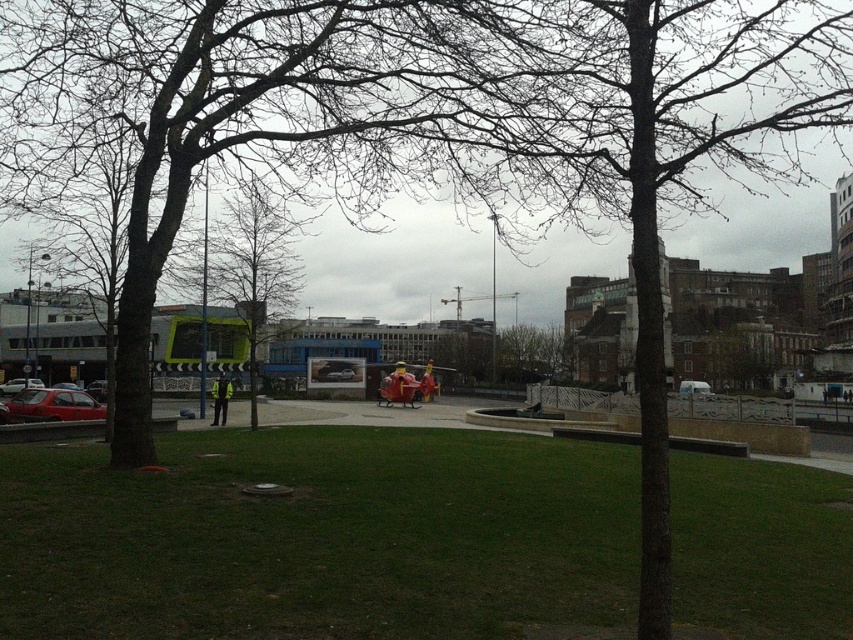
You are standing at the bottom left corner of the park and want to walk to the red helicopter model in the middle ground. Which direction should you head to avoid stepping on the green grass at center?

You should head towards the paved area where the red helicopter model is located, as the green grass at center is located at point (318,536), which is away from the paved path.

You are a pedestrian standing at the edge of the park and want to cross to the other side. There is a matte red car at lower left and a high visibility yellow jacket at center in your path. Which object should you avoid first while crossing?

You should avoid the matte red car at lower left first because it is in front of the high visibility yellow jacket at center, meaning it is closer to your starting position.

You are standing at the center of the park and want to locate the matte red car at lower left. According to the coordinates provided, in which direction should you walk to find it?

The matte red car at lower left is located at coordinates point (53, 404), which means you should walk towards the lower left direction from the center to find it.